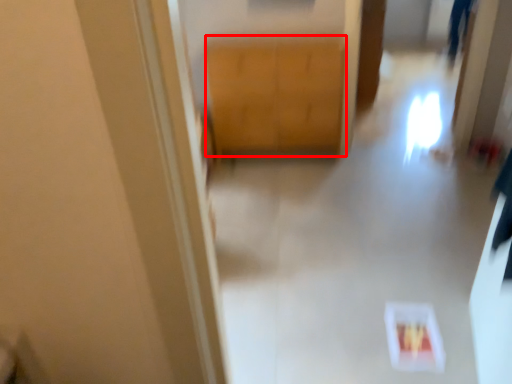
Question: From the image's perspective, where is cabinetry (annotated by the red box) located relative to path?

Choices:
 (A) below
 (B) above

Answer: (B)